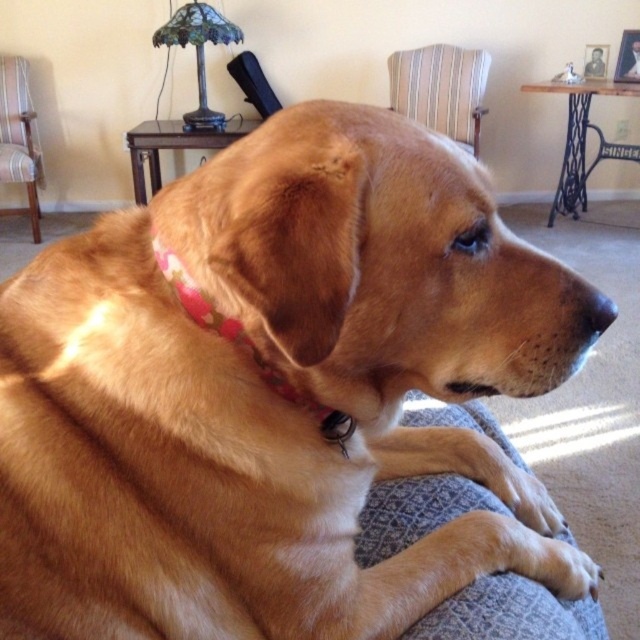
You are standing in the living room and want to take a photo of the dog. The camera you have can only focus on objects within 1 meter. Is the point at coordinates point (x=433, y=408) within the camera focus range?

The point at coordinates point (x=433, y=408) is 1.16 meters away from the camera, which is beyond the camera focus range of 1 meter. Therefore, the camera cannot focus on that point.

You are a dog owner who wants to place a new toy between the gray fabric dog bed at lower center and the striped fabric armchair at upper center. Based on their positions, which object should the toy be closer to if you want it near the front of the image?

The gray fabric dog bed at lower center is closer to the viewer than the striped fabric armchair at upper center, so placing the toy closer to the gray fabric dog bed at lower center would position it near the front of the image.